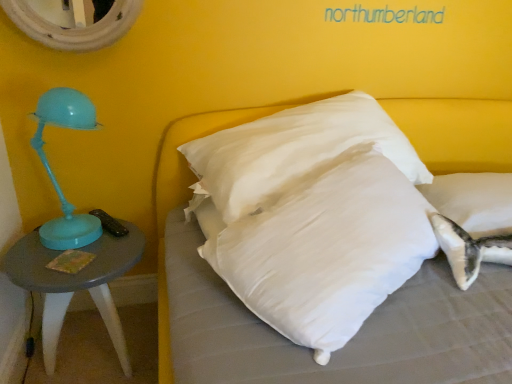
Question: Considering the relative sizes of white soft pillow at center and white soft pillow at center in the image provided, is white soft pillow at center taller than white soft pillow at center?

Choices:
 (A) yes
 (B) no

Answer: (A)

Question: Is white soft pillow at center turned away from white soft pillow at center?

Choices:
 (A) no
 (B) yes

Answer: (A)

Question: Would you say white soft pillow at center is outside white soft pillow at center?

Choices:
 (A) no
 (B) yes

Answer: (B)

Question: Can you confirm if white soft pillow at center is smaller than white soft pillow at center?

Choices:
 (A) yes
 (B) no

Answer: (B)

Question: Is white soft pillow at center in contact with white soft pillow at center?

Choices:
 (A) no
 (B) yes

Answer: (A)

Question: Can you confirm if white soft pillow at center is thinner than white soft pillow at center?

Choices:
 (A) no
 (B) yes

Answer: (B)

Question: Does white soft pillow at center have a greater width compared to white textured mirror at upper left?

Choices:
 (A) no
 (B) yes

Answer: (B)

Question: Could white textured mirror at upper left be considered to be inside white soft pillow at center?

Choices:
 (A) yes
 (B) no

Answer: (B)

Question: Is there a large distance between white soft pillow at center and white textured mirror at upper left?

Choices:
 (A) no
 (B) yes

Answer: (B)

Question: Is the depth of white soft pillow at center greater than that of white textured mirror at upper left?

Choices:
 (A) yes
 (B) no

Answer: (A)

Question: From the image's perspective, is white soft pillow at center beneath white textured mirror at upper left?

Choices:
 (A) no
 (B) yes

Answer: (B)

Question: Does white soft pillow at center appear on the left side of white textured mirror at upper left?

Choices:
 (A) yes
 (B) no

Answer: (B)

Question: From the image's perspective, is matte gray table at left located beneath white soft pillow at center?

Choices:
 (A) yes
 (B) no

Answer: (A)